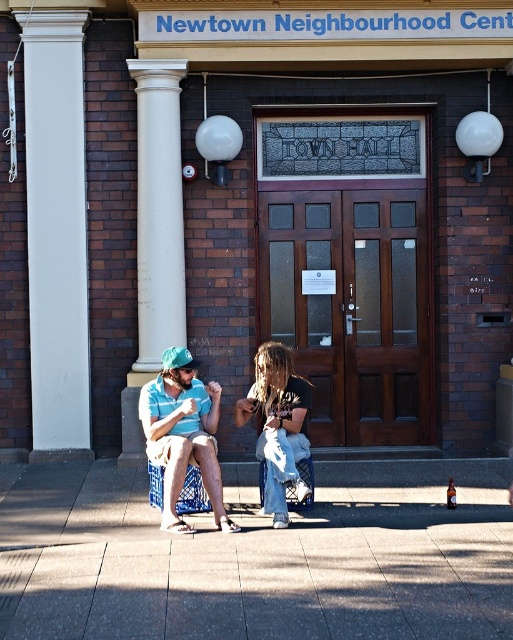
Question: Which point appears farthest from the camera in this image?

Choices:
 (A) [x=132, y=576]
 (B) [x=152, y=355]
 (C) [x=301, y=404]
 (D) [x=81, y=340]

Answer: (D)

Question: In this image, where is white smooth column at left located relative to matte blue shorts at center?

Choices:
 (A) left
 (B) right

Answer: (A)

Question: Can you confirm if gray concrete pavement at lower center is positioned above white smooth pillar at left?

Choices:
 (A) no
 (B) yes

Answer: (A)

Question: Considering the real-world distances, which object is farthest from the white smooth column at left?

Choices:
 (A) matte blue shorts at center
 (B) gray concrete pavement at lower center
 (C) white smooth pillar at left
 (D) denim pants at center

Answer: (B)

Question: Does white smooth pillar at left appear on the left side of denim pants at center?

Choices:
 (A) no
 (B) yes

Answer: (B)

Question: Which object is farther from the camera taking this photo?

Choices:
 (A) denim pants at center
 (B) white smooth column at left

Answer: (B)